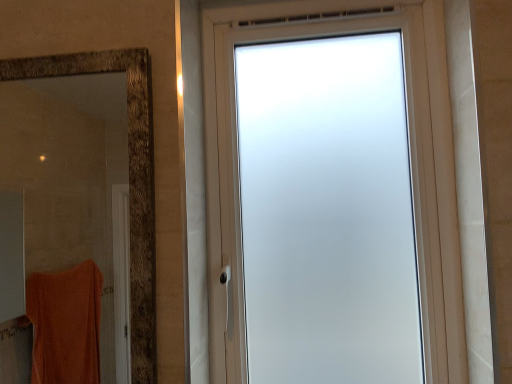
I want to click on brown textured mirror at left, so click(x=69, y=178).

The width and height of the screenshot is (512, 384). Describe the element at coordinates (69, 178) in the screenshot. I see `brown textured mirror at left` at that location.

Measure the distance between frosted glass window at center and camera.

The depth of frosted glass window at center is 88.73 centimeters.

Image resolution: width=512 pixels, height=384 pixels. What do you see at coordinates (411, 164) in the screenshot? I see `frosted glass window at center` at bounding box center [411, 164].

Measure the distance between point (416,47) and camera.

37.32 inches.

Find the location of `frosted glass window at center`. frosted glass window at center is located at coordinates (411, 164).

Locate an element on the screen. This screenshot has width=512, height=384. brown textured mirror at left is located at coordinates [69, 178].

Which is more to the left, frosted glass window at center or brown textured mirror at left?

brown textured mirror at left.

Which object is closer to the camera, frosted glass window at center or brown textured mirror at left?

Positioned in front is brown textured mirror at left.

Which point is more forward, (450, 134) or (35, 160)?

The point (450, 134) is closer to the camera.

From the image's perspective, is frosted glass window at center above or below brown textured mirror at left?

Clearly, from the image's perspective, frosted glass window at center is above brown textured mirror at left.

From a real-world perspective, between frosted glass window at center and brown textured mirror at left, who is vertically lower?

brown textured mirror at left.

Considering the relative sizes of frosted glass window at center and brown textured mirror at left in the image provided, is frosted glass window at center wider than brown textured mirror at left?

Indeed, frosted glass window at center has a greater width compared to brown textured mirror at left.

In terms of height, does frosted glass window at center look taller or shorter compared to brown textured mirror at left?

Considering their sizes, frosted glass window at center has more height than brown textured mirror at left.

Is frosted glass window at center bigger than brown textured mirror at left?

Indeed, frosted glass window at center has a larger size compared to brown textured mirror at left.

Is frosted glass window at center located outside brown textured mirror at left?

That's correct, frosted glass window at center is outside of brown textured mirror at left.

Is the surface of frosted glass window at center in direct contact with brown textured mirror at left?

No, frosted glass window at center is not with brown textured mirror at left.

Is frosted glass window at center aimed at brown textured mirror at left?

No.

What's the angular difference between frosted glass window at center and brown textured mirror at left's facing directions?

The facing directions of frosted glass window at center and brown textured mirror at left are 0.478 degrees apart.

Identify the location of window lying on the right of brown textured mirror at left. (411, 164).

Looking at this image, which is more to the right, brown textured mirror at left or frosted glass window at center?

From the viewer's perspective, frosted glass window at center appears more on the right side.

Considering their positions, is brown textured mirror at left located in front of or behind frosted glass window at center?

brown textured mirror at left is in front of frosted glass window at center.

Considering the positions of point (7, 367) and point (359, 13), is point (7, 367) closer or farther from the camera than point (359, 13)?

Clearly, point (7, 367) is more distant from the camera than point (359, 13).

From the image's perspective, which object appears higher, brown textured mirror at left or frosted glass window at center?

From the image's view, frosted glass window at center is above.

From a real-world perspective, which is physically below, brown textured mirror at left or frosted glass window at center?

From a 3D spatial view, brown textured mirror at left is below.

Which object is thinner, brown textured mirror at left or frosted glass window at center?

brown textured mirror at left is thinner.

Based on the photo, considering the sizes of objects brown textured mirror at left and frosted glass window at center in the image provided, who is taller, brown textured mirror at left or frosted glass window at center?

With more height is frosted glass window at center.

Who is smaller, brown textured mirror at left or frosted glass window at center?

With smaller size is brown textured mirror at left.

Is brown textured mirror at left not within frosted glass window at center?

That's correct, brown textured mirror at left is outside of frosted glass window at center.

Is brown textured mirror at left directly adjacent to frosted glass window at center?

No, brown textured mirror at left is not touching frosted glass window at center.

Is brown textured mirror at left facing away from frosted glass window at center?

No, brown textured mirror at left is not facing the opposite direction of frosted glass window at center.

Can you tell me how much brown textured mirror at left and frosted glass window at center differ in facing direction?

The angular difference between brown textured mirror at left and frosted glass window at center is 0.478 degrees.

The width and height of the screenshot is (512, 384). Identify the location of window above the brown textured mirror at left (from the image's perspective). (411, 164).

Where is `mirror that appears below the frosted glass window at center (from a real-world perspective)`? The height and width of the screenshot is (384, 512). mirror that appears below the frosted glass window at center (from a real-world perspective) is located at coordinates (69, 178).

Identify the location of window that appears above the brown textured mirror at left (from a real-world perspective). This screenshot has width=512, height=384. (411, 164).